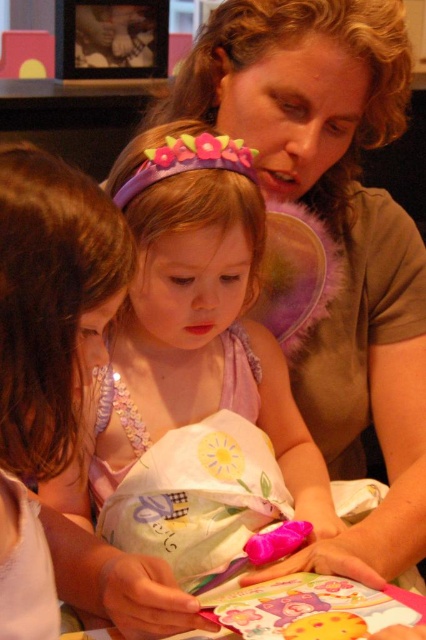
Can you confirm if pink satin dress at center is taller than matte brown shirt at upper right?

No.

Does point (221, 449) lie in front of point (196, 112)?

Yes.

The height and width of the screenshot is (640, 426). In order to click on pink satin dress at center in this screenshot , I will do `click(193, 374)`.